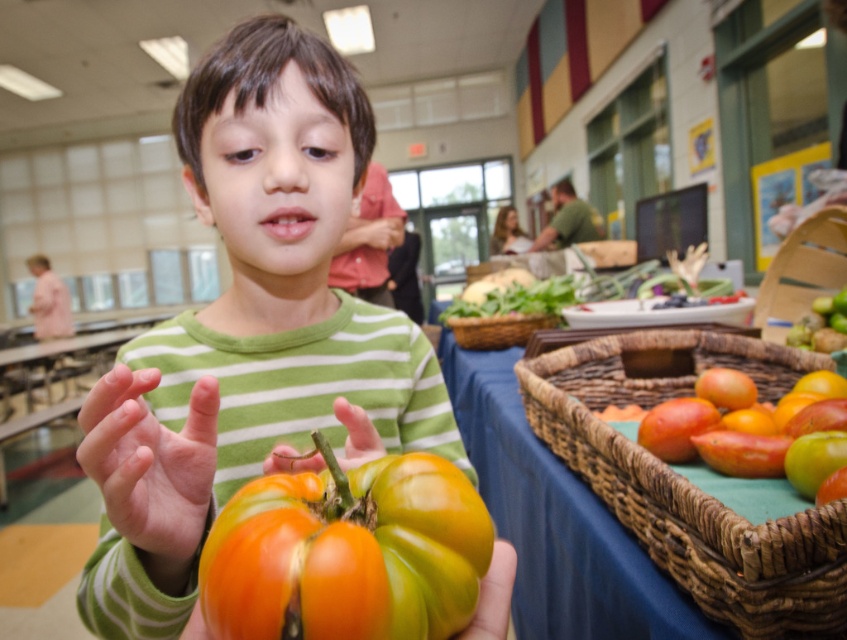
Does woven brown basket at lower right have a smaller size compared to smooth green hand at center?

Incorrect, woven brown basket at lower right is not smaller in size than smooth green hand at center.

Find the location of a particular element. The width and height of the screenshot is (847, 640). woven brown basket at lower right is located at coordinates (687, 481).

Is point (670, 385) positioned in front of point (378, 445)?

No, (670, 385) is further to viewer.

I want to click on woven brown basket at lower right, so click(687, 481).

In the scene shown: Between matte green shirt at center and brown woven basket at center, which one is positioned lower?

Positioned lower is brown woven basket at center.

Who is more distant from viewer, (313, 45) or (479, 342)?

The point (479, 342) is more distant.

In order to click on matte green shirt at center in this screenshot , I will do (x=248, y=326).

Where is `matte green shirt at center`? matte green shirt at center is located at coordinates (248, 326).

Locate an element on the screen. This screenshot has height=640, width=847. matte green shirt at center is located at coordinates (248, 326).

Is point (269, 168) closer to camera compared to point (355, 448)?

No, (269, 168) is behind (355, 448).

Who is more forward, [106,378] or [371,458]?

Point [106,378]

This screenshot has height=640, width=847. Find the location of `matte green shirt at center`. matte green shirt at center is located at coordinates (248, 326).